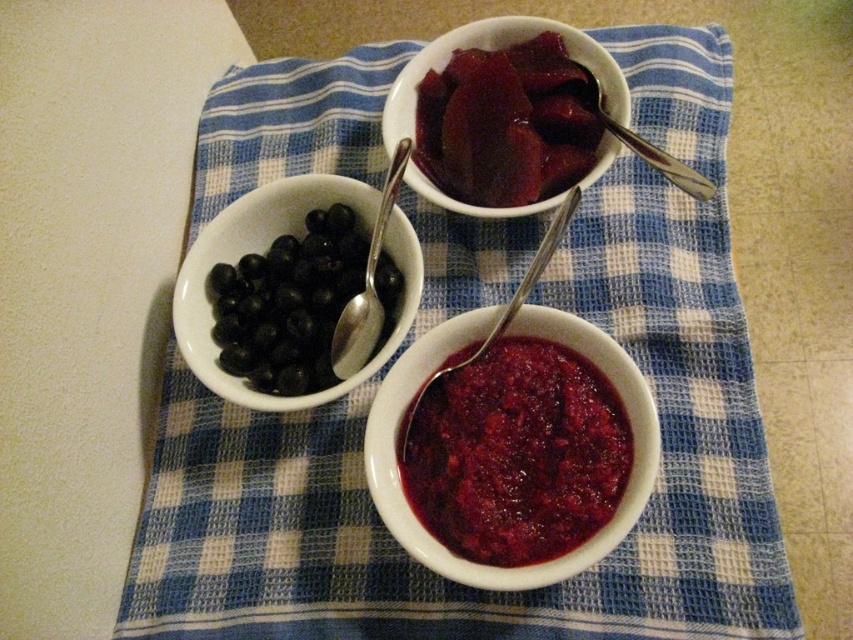
How far apart are matte ceramic bowl at upper center and satin silver spoon at upper left?

15.09 centimeters

Is point (535, 205) in front of point (392, 168)?

Yes, it is.

The height and width of the screenshot is (640, 853). I want to click on matte ceramic bowl at upper center, so click(492, 49).

Is matte ceramic bowl at center positioned before black matte blueberries at left?

Yes, it is in front of black matte blueberries at left.

Is point (483, 564) more distant than point (254, 276)?

No, it is in front of (254, 276).

Identify the location of matte ceramic bowl at center. The image size is (853, 640). (437, 365).

Does black matte blueberries at left have a greater height compared to silver metallic spoon at upper right?

Yes.

Describe the element at coordinates (289, 304) in the screenshot. The width and height of the screenshot is (853, 640). I see `black matte blueberries at left` at that location.

Image resolution: width=853 pixels, height=640 pixels. In order to click on black matte blueberries at left in this screenshot , I will do `click(289, 304)`.